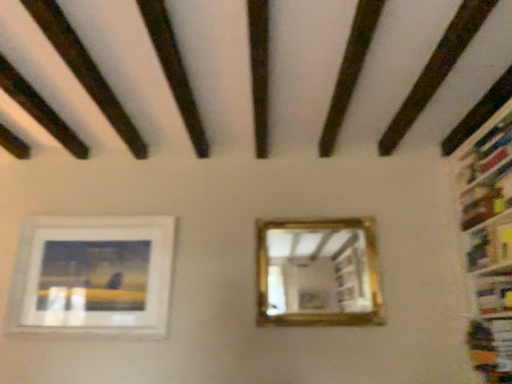
What are the coordinates of `dark brown wood at upper left` in the screenshot? It's located at (85, 70).

What do you see at coordinates (317, 271) in the screenshot?
I see `gold-framed mirror at center` at bounding box center [317, 271].

The width and height of the screenshot is (512, 384). I want to click on hardcover book at right, which appears as the second book when ordered from the bottom, so click(x=489, y=246).

What is the approximate width of white matte picture frame at lower left?

7.17 centimeters.

Measure the distance between hardcover book at right, the first book ordered from the bottom, and camera.

They are 7.14 feet apart.

Identify the location of dark brown wood at upper left. (85, 70).

Can you confirm if gold-framed mirror at center is positioned to the right of dark brown wood at upper left?

Yes, gold-framed mirror at center is to the right of dark brown wood at upper left.

Could you tell me if gold-framed mirror at center is facing dark brown wood at upper left?

No, gold-framed mirror at center is not oriented towards dark brown wood at upper left.

Looking at their sizes, would you say gold-framed mirror at center is wider or thinner than dark brown wood at upper left?

gold-framed mirror at center is thinner than dark brown wood at upper left.

Does point (310, 264) appear closer or farther from the camera than point (60, 28)?

Clearly, point (310, 264) is more distant from the camera than point (60, 28).

Can you confirm if hardcover book at right, which is the 1th book in top-to-bottom order, is bigger than dark brown wood at upper left?

Actually, hardcover book at right, which is the 1th book in top-to-bottom order, might be smaller than dark brown wood at upper left.

From the image's perspective, is hardcover book at right, which appears as the second book when ordered from the bottom, beneath dark brown wood at upper left?

Yes, from the image's perspective, hardcover book at right, which appears as the second book when ordered from the bottom, is beneath dark brown wood at upper left.

From a real-world perspective, who is located higher, hardcover book at right, which appears as the second book when ordered from the bottom, or dark brown wood at upper left?

dark brown wood at upper left is physically above.

Are hardcover book at right, which appears as the second book when ordered from the bottom, and dark brown wood at upper left making contact?

No, hardcover book at right, which appears as the second book when ordered from the bottom, is not making contact with dark brown wood at upper left.

Considering the positions of objects hardcover book at right, which appears as the second book when viewed from the top, and gold-framed mirror at center in the image provided, who is more to the left, hardcover book at right, which appears as the second book when viewed from the top, or gold-framed mirror at center?

gold-framed mirror at center is more to the left.

From a real-world perspective, is hardcover book at right, which appears as the second book when viewed from the top, on gold-framed mirror at center?

No.

From the image's perspective, is hardcover book at right, the first book ordered from the bottom, above gold-framed mirror at center?

Actually, hardcover book at right, the first book ordered from the bottom, appears below gold-framed mirror at center in the image.

Where is `mirror behind the hardcover book at right, which appears as the second book when viewed from the top`? This screenshot has width=512, height=384. mirror behind the hardcover book at right, which appears as the second book when viewed from the top is located at coordinates (317, 271).

Find the location of a particular element. The image size is (512, 384). plank that appears above the white matte picture frame at lower left (from the image's perspective) is located at coordinates [85, 70].

How much distance is there between dark brown wood at upper left and white matte picture frame at lower left?

They are 34.93 inches apart.

Is dark brown wood at upper left far away from white matte picture frame at lower left?

dark brown wood at upper left is near white matte picture frame at lower left, not far away.

Which is more to the left, dark brown wood at upper left or white matte picture frame at lower left?

Positioned to the left is white matte picture frame at lower left.

Is hardcover book at right, which appears as the second book when ordered from the bottom, not close to hardcover book at right, which appears as the second book when viewed from the top?

No, there isn't a large distance between hardcover book at right, which appears as the second book when ordered from the bottom, and hardcover book at right, which appears as the second book when viewed from the top.

From the image's perspective, which object appears higher, hardcover book at right, which appears as the second book when ordered from the bottom, or hardcover book at right, which appears as the second book when viewed from the top?

hardcover book at right, which appears as the second book when ordered from the bottom.

Between hardcover book at right, which appears as the second book when ordered from the bottom, and hardcover book at right, which appears as the second book when viewed from the top, which one has smaller width?

hardcover book at right, which appears as the second book when viewed from the top, is thinner.

Which of these two, hardcover book at right, which is the 1th book in top-to-bottom order, or hardcover book at right, which appears as the second book when viewed from the top, stands taller?

Standing taller between the two is hardcover book at right, which is the 1th book in top-to-bottom order.

Which of these two, dark brown wood at upper left or gold-framed mirror at center, is wider?

With larger width is dark brown wood at upper left.

Would you consider dark brown wood at upper left to be distant from gold-framed mirror at center?

dark brown wood at upper left is positioned a significant distance from gold-framed mirror at center.

Visually, is dark brown wood at upper left positioned to the left or to the right of gold-framed mirror at center?

dark brown wood at upper left is to the left of gold-framed mirror at center.

Which is behind, point (59, 14) or point (365, 280)?

The point (365, 280) is farther from the camera.

Can you confirm if hardcover book at right, which appears as the second book when ordered from the bottom, is taller than white matte picture frame at lower left?

No.

Between point (471, 253) and point (32, 285), which one is positioned behind?

Positioned behind is point (32, 285).

Who is more distant, hardcover book at right, which is the 1th book in top-to-bottom order, or white matte picture frame at lower left?

white matte picture frame at lower left is more distant.

The image size is (512, 384). Identify the location of mirror on the right of dark brown wood at upper left. (317, 271).

Identify the location of the 1st book positioned below the dark brown wood at upper left (from a real-world perspective). This screenshot has width=512, height=384. (489, 246).

Considering their positions, is hardcover book at right, which appears as the second book when ordered from the bottom, positioned closer to hardcover book at right, the first book ordered from the bottom, than white matte picture frame at lower left?

The object closer to hardcover book at right, the first book ordered from the bottom, is hardcover book at right, which appears as the second book when ordered from the bottom.

When comparing their distances from hardcover book at right, which appears as the second book when ordered from the bottom, does white matte picture frame at lower left or dark brown wood at upper left seem further?

Among the two, white matte picture frame at lower left is located further to hardcover book at right, which appears as the second book when ordered from the bottom.

From the image, which object appears to be nearer to dark brown wood at upper left, hardcover book at right, which is the 1th book in top-to-bottom order, or white matte picture frame at lower left?

white matte picture frame at lower left.

When comparing their distances from hardcover book at right, which is the 1th book in top-to-bottom order, does dark brown wood at upper left or gold-framed mirror at center seem closer?

Among the two, gold-framed mirror at center is located nearer to hardcover book at right, which is the 1th book in top-to-bottom order.

Consider the image. Looking at the image, which one is located closer to gold-framed mirror at center, hardcover book at right, which is the 1th book in top-to-bottom order, or dark brown wood at upper left?

hardcover book at right, which is the 1th book in top-to-bottom order, is positioned closer to the anchor gold-framed mirror at center.

When comparing their distances from white matte picture frame at lower left, does hardcover book at right, which appears as the second book when ordered from the bottom, or gold-framed mirror at center seem further?

hardcover book at right, which appears as the second book when ordered from the bottom.

Looking at the image, which one is located closer to dark brown wood at upper left, hardcover book at right, which is the 1th book in top-to-bottom order, or hardcover book at right, the first book ordered from the bottom?

hardcover book at right, which is the 1th book in top-to-bottom order, is positioned closer to the anchor dark brown wood at upper left.

Looking at the image, which one is located closer to hardcover book at right, which appears as the second book when viewed from the top, gold-framed mirror at center or hardcover book at right, which appears as the second book when ordered from the bottom?

Among the two, hardcover book at right, which appears as the second book when ordered from the bottom, is located nearer to hardcover book at right, which appears as the second book when viewed from the top.

Identify the location of book between dark brown wood at upper left and hardcover book at right, the first book ordered from the bottom. The width and height of the screenshot is (512, 384). (489, 246).

This screenshot has height=384, width=512. Identify the location of book located between gold-framed mirror at center and hardcover book at right, the first book ordered from the bottom, in the left-right direction. (489, 246).

Locate an element on the screen. mirror between dark brown wood at upper left and hardcover book at right, the first book ordered from the bottom, in the horizontal direction is located at coordinates (317, 271).

Locate an element on the screen. mirror between white matte picture frame at lower left and hardcover book at right, which is the 1th book in top-to-bottom order is located at coordinates (317, 271).